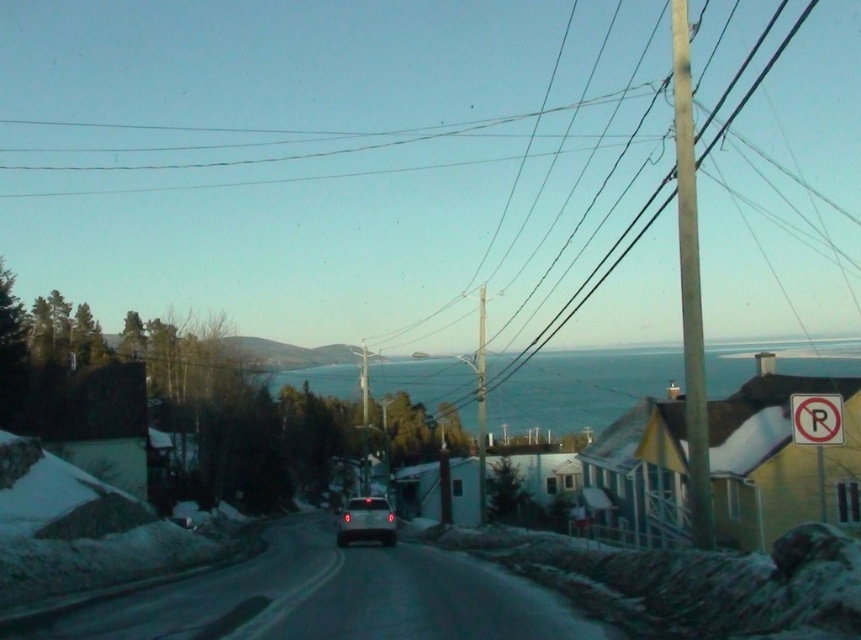
Does white plastic no parking sign at right have a lesser height compared to satin silver sedan at center?

No.

Does point (816, 452) come closer to viewer compared to point (360, 502)?

Yes, it is.

Locate an element on the screen. The image size is (861, 640). white plastic no parking sign at right is located at coordinates (816, 429).

Does point (689, 92) come behind point (791, 404)?

Yes, point (689, 92) is farther from viewer.

The width and height of the screenshot is (861, 640). In order to click on smooth wooden pole at right in this screenshot , I will do `click(691, 285)`.

Does white plastic no parking sign at upper right appear on the left side of smooth wooden utility pole at center?

Correct, you'll find white plastic no parking sign at upper right to the left of smooth wooden utility pole at center.

Can you confirm if white plastic no parking sign at upper right is bigger than smooth wooden utility pole at center?

Incorrect, white plastic no parking sign at upper right is not larger than smooth wooden utility pole at center.

Where is `white plastic no parking sign at upper right`? white plastic no parking sign at upper right is located at coordinates (816, 419).